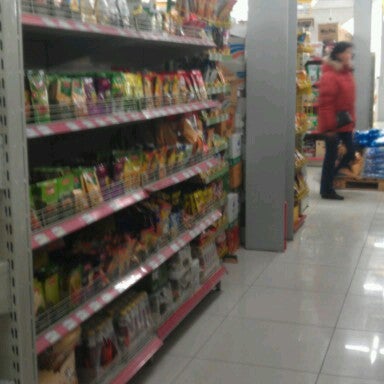
Find the location of a particular element. ceiling is located at coordinates (338, 2).